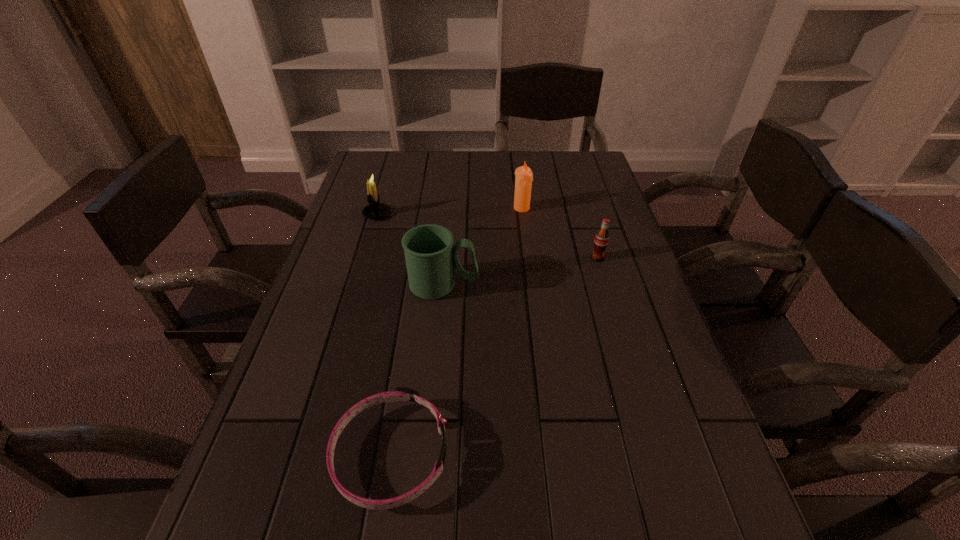
Identify the location of empty location between the soda and the candle. Image resolution: width=960 pixels, height=540 pixels. (560, 233).

At what (x,y) coordinates should I click in order to perform the action: click on unoccupied area between the second object from right to left and the mug. Please return your answer as a coordinate pair (x, y). This screenshot has height=540, width=960. Looking at the image, I should click on (483, 246).

Image resolution: width=960 pixels, height=540 pixels. I want to click on free space between the rightmost object and the shortest object, so click(x=494, y=356).

Identify the location of free space that is in between the leftmost object and the candle. The height and width of the screenshot is (540, 960). (449, 211).

Image resolution: width=960 pixels, height=540 pixels. I want to click on free space between the soda and the mug, so click(520, 271).

Where is `free space that is in between the second object from right to left and the nearest object`? This screenshot has width=960, height=540. free space that is in between the second object from right to left and the nearest object is located at coordinates (456, 331).

I want to click on vacant area that lies between the rightmost object and the mug, so click(520, 271).

Where is `free spot between the fourth object from left to right and the fourth farthest object`? The height and width of the screenshot is (540, 960). free spot between the fourth object from left to right and the fourth farthest object is located at coordinates [483, 246].

Select which object is the closest to the leftmost object. Please provide its 2D coordinates. Your answer should be formatted as a tuple, i.e. [(x, y)], where the tuple contains the x and y coordinates of a point satisfying the conditions above.

[(431, 257)]

You are a GUI agent. You are given a task and a screenshot of the screen. Output one action in this format:
    pyautogui.click(x=<x>, y=<y>)
    Task: Click on the object that is the second closest one to the candle holder
    The height and width of the screenshot is (540, 960).
    Given the screenshot: What is the action you would take?
    pyautogui.click(x=523, y=181)